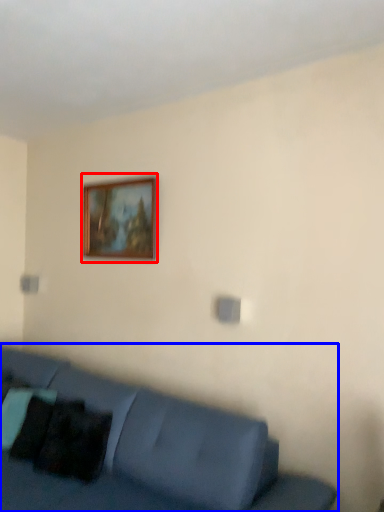
Question: Which object is further to the camera taking this photo, picture frame (highlighted by a red box) or studio couch (highlighted by a blue box)?

Choices:
 (A) picture frame
 (B) studio couch

Answer: (A)